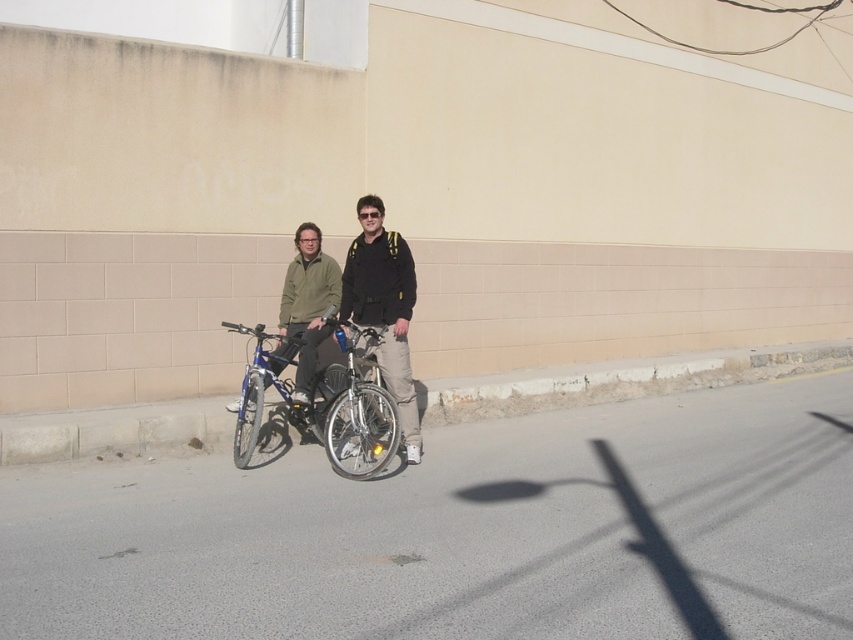
Between matte black jackets at center and shiny metallic bicycle at center, which one has less height?

Standing shorter between the two is shiny metallic bicycle at center.

Who is positioned more to the right, matte black jackets at center or shiny metallic bicycle at center?

matte black jackets at center

Identify the location of matte black jackets at center. This screenshot has width=853, height=640. (384, 308).

Where is `matte black jackets at center`? This screenshot has height=640, width=853. matte black jackets at center is located at coordinates (384, 308).

This screenshot has height=640, width=853. I want to click on shiny blue bicycle at center, so click(x=321, y=403).

Which is above, shiny blue bicycle at center or shiny metallic bicycle at center?

Positioned higher is shiny blue bicycle at center.

The image size is (853, 640). What do you see at coordinates (321, 403) in the screenshot? I see `shiny blue bicycle at center` at bounding box center [321, 403].

Identify the location of shiny blue bicycle at center. click(321, 403).

Between matte black jacket at center and shiny metallic bicycle at center, which one has more height?

With more height is matte black jacket at center.

Which is more to the left, matte black jacket at center or shiny metallic bicycle at center?

From the viewer's perspective, shiny metallic bicycle at center appears more on the left side.

At what (x,y) coordinates should I click in order to perform the action: click on matte black jacket at center. Please return your answer as a coordinate pair (x, y). Image resolution: width=853 pixels, height=640 pixels. Looking at the image, I should click on (384, 308).